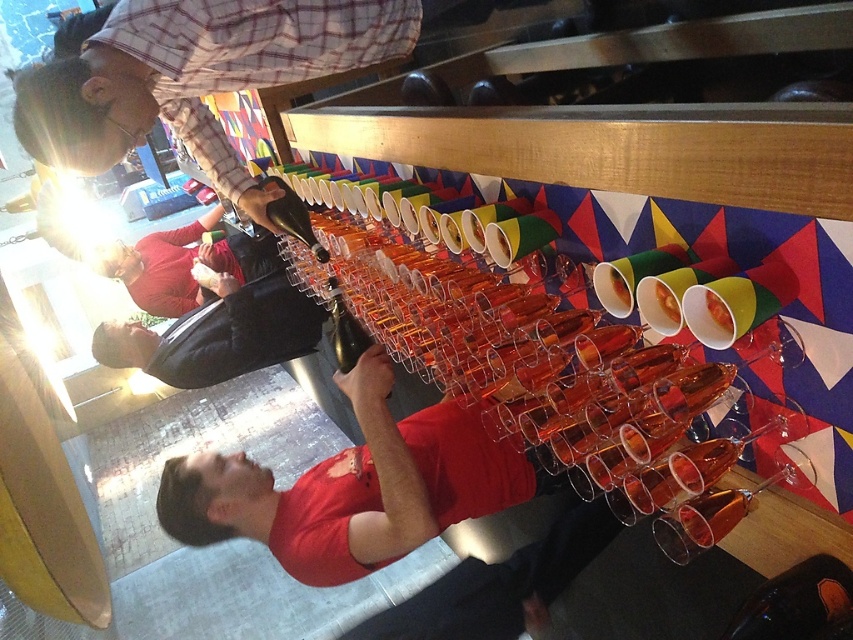
Which is below, plaid shirt at upper left or matte red sweater at lower left?

Positioned lower is matte red sweater at lower left.

Is point (73, 72) more distant than point (161, 236)?

No, (73, 72) is in front of (161, 236).

The width and height of the screenshot is (853, 640). What are the coordinates of `plaid shirt at upper left` in the screenshot? It's located at (195, 76).